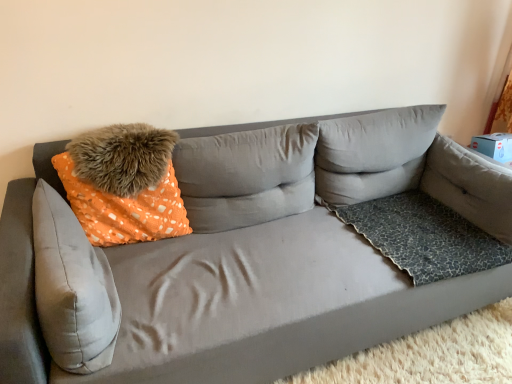
Question: Is leopard print fabric pillow at right, the 5th pillow in the left-to-right sequence, bigger or smaller than orange dotted fabric pillow at upper center, the 3th pillow positioned from the right?

Choices:
 (A) big
 (B) small

Answer: (B)

Question: Visually, is leopard print fabric pillow at right, the 1th pillow from the right, positioned to the left or to the right of orange dotted fabric pillow at upper center, which is the 3th pillow in left-to-right order?

Choices:
 (A) right
 (B) left

Answer: (A)

Question: Which of these objects is positioned closest to the orange dotted fabric pillow at left?

Choices:
 (A) orange dotted fabric pillow at upper center, which is the 3th pillow in left-to-right order
 (B) leopard print fabric pillow at right, the 1th pillow from the right
 (C) fuzzy fur pillow at upper left, acting as the second pillow starting from the left
 (D) leopard print fabric dog bed at right
 (E) gray fabric pillow at upper right, the 4th pillow when ordered from left to right

Answer: (C)

Question: Considering the real-world distances, which object is farthest from the orange dotted fabric pillow at left?

Choices:
 (A) gray fabric pillow at upper right, the 2th pillow in the right-to-left sequence
 (B) fuzzy fur pillow at upper left, the fourth pillow in the right-to-left sequence
 (C) suede gray couch at center
 (D) leopard print fabric pillow at right, the 1th pillow from the right
 (E) orange dotted fabric pillow at upper center, the 3th pillow positioned from the right

Answer: (D)